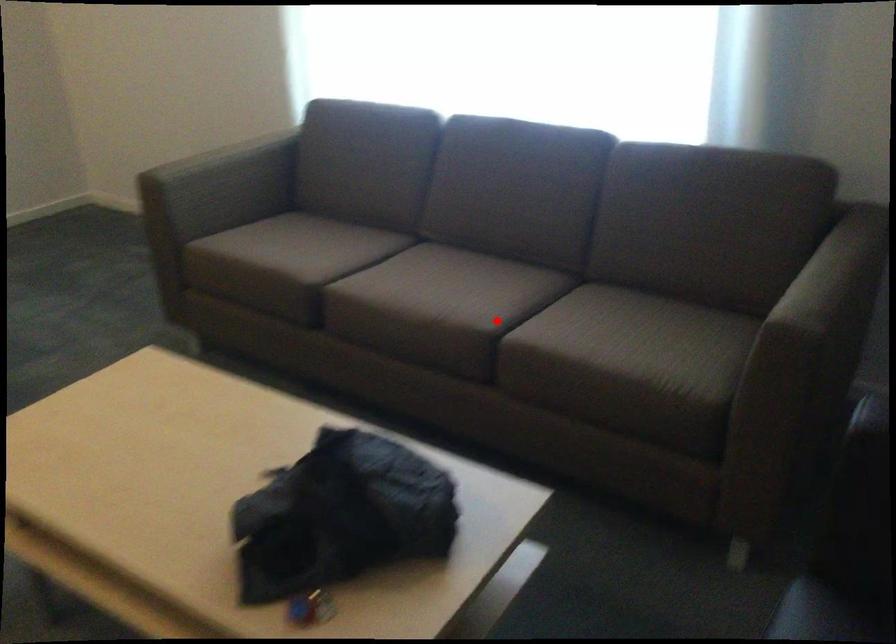
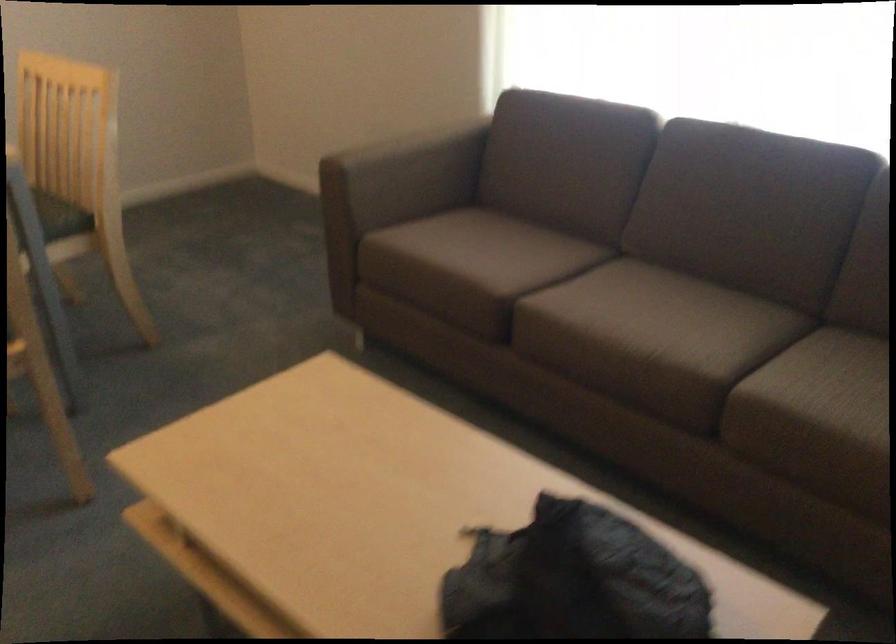
Question: I am providing you with two images of the same scene from different viewpoints. Given a red point in image1, look at the same physical point in image2. Is it:

Choices:
 (A) Closer to the viewpoint
 (B) Farther from the viewpoint

Answer: (A)